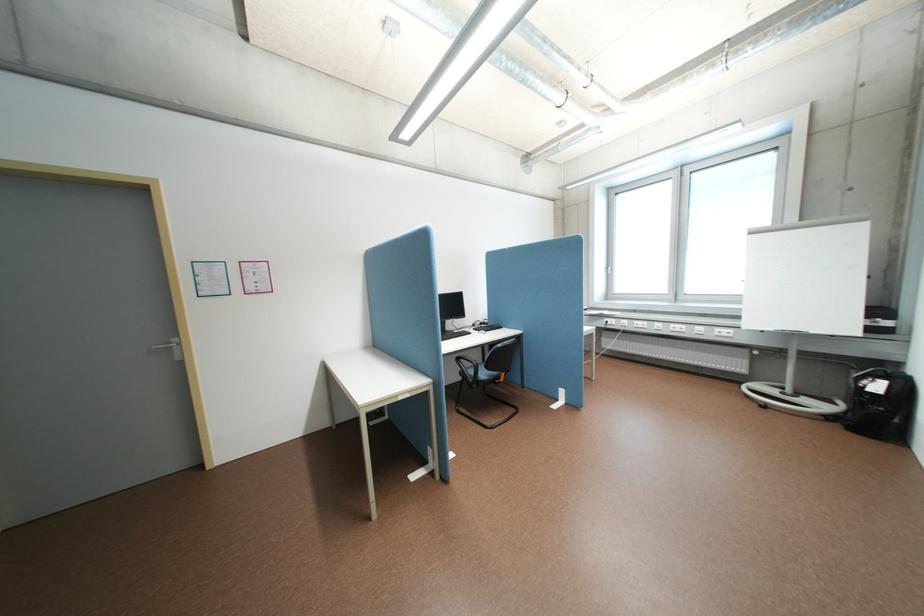
The width and height of the screenshot is (924, 616). Identify the location of chair sitting surface. (484, 371).